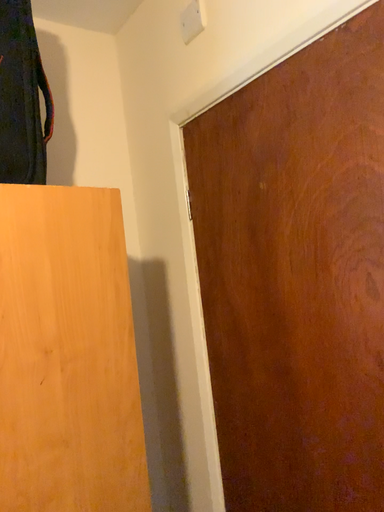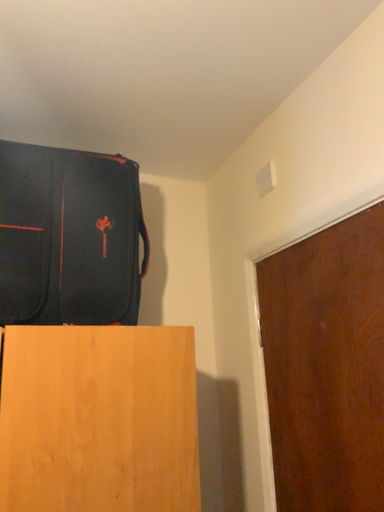
Question: Which way did the camera rotate in the video?

Choices:
 (A) rotated right
 (B) rotated left

Answer: (B)